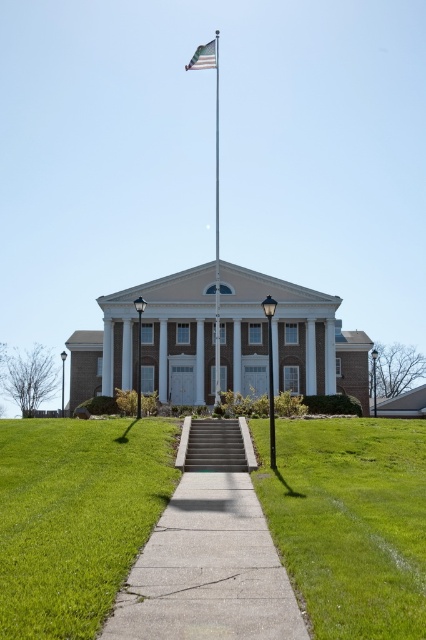
Looking at this image, is the position of concrete at center more distant than that of american flag at upper center?

No.

Which is more to the left, concrete at center or american flag at upper center?

american flag at upper center

Is point (227, 436) positioned behind point (195, 52)?

No, (227, 436) is in front of (195, 52).

Where is `concrete at center`? This screenshot has height=640, width=426. concrete at center is located at coordinates (209, 554).

Can you confirm if green concrete stairs at center is positioned to the right of american flag at upper center?

Correct, you'll find green concrete stairs at center to the right of american flag at upper center.

Describe the element at coordinates (215, 445) in the screenshot. The image size is (426, 640). I see `green concrete stairs at center` at that location.

Where is `green concrete stairs at center`? green concrete stairs at center is located at coordinates (215, 445).

Which of these two, concrete at center or green concrete stairs at center, stands shorter?

green concrete stairs at center is shorter.

From the picture: Does concrete at center lie in front of green concrete stairs at center?

That is True.

I want to click on concrete at center, so click(x=209, y=554).

The height and width of the screenshot is (640, 426). What are the coordinates of `concrete at center` in the screenshot? It's located at (209, 554).